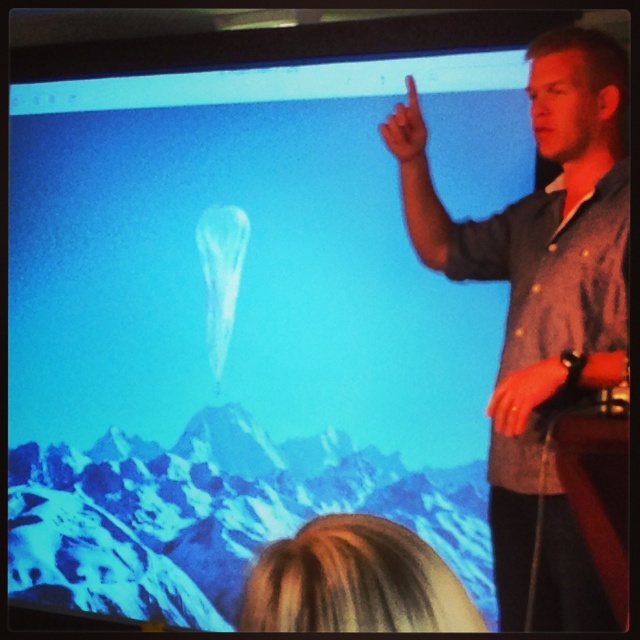
You are attending a presentation and see the speaker pointing towards the screen. There are two points marked on the screen at coordinates point (348, 625) and point (403, 140). Which point is closer to you?

Point (348, 625) is closer to the viewer than point (403, 140).

You are an attendee at the presentation and notice the blonde hair at upper center and the matte skin finger at upper center in the screen. Which object is closer to the top of the screen?

The matte skin finger at upper center is closer to the top of the screen because the blonde hair at upper center is positioned under it.